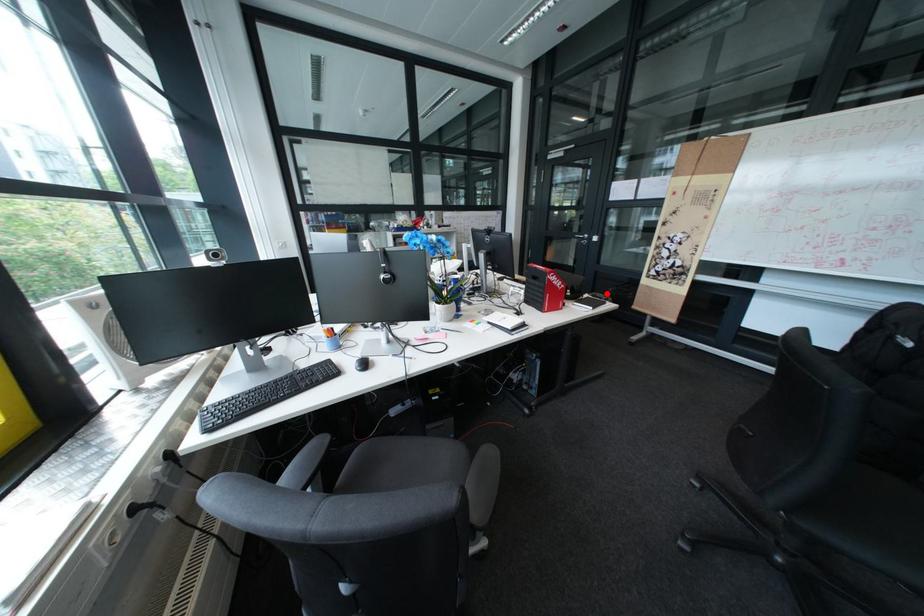
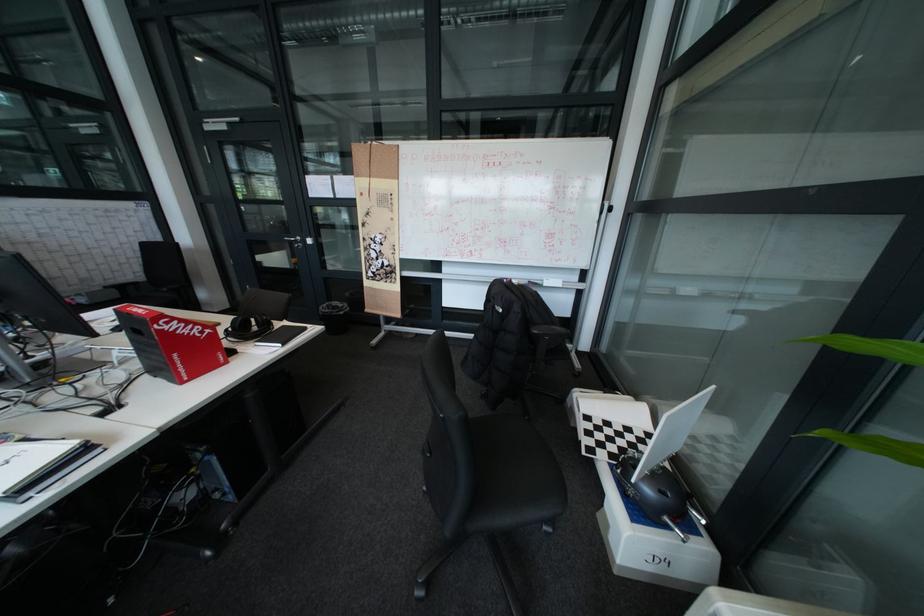
The point at the highlighted location is marked in the first image. Where is the corresponding point in the second image?

(341, 304)